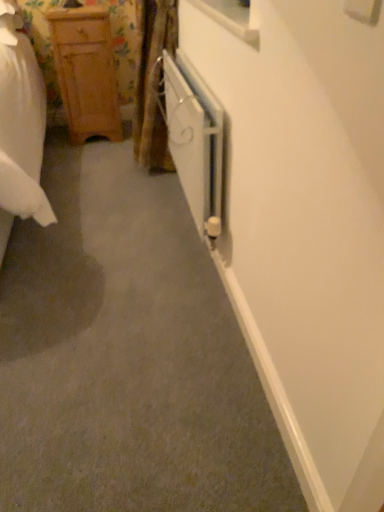
Question: In terms of size, does white matte radiator at center appear bigger or smaller than wooden cabinet at left?

Choices:
 (A) big
 (B) small

Answer: (B)

Question: From a real-world perspective, is white matte radiator at center positioned above or below wooden cabinet at left?

Choices:
 (A) below
 (B) above

Answer: (B)

Question: In terms of width, does white matte radiator at center look wider or thinner when compared to wooden cabinet at left?

Choices:
 (A) wide
 (B) thin

Answer: (B)

Question: Is wooden cabinet at left wider or thinner than white matte radiator at center?

Choices:
 (A) thin
 (B) wide

Answer: (B)

Question: From the image's perspective, relative to white matte radiator at center, is wooden cabinet at left above or below?

Choices:
 (A) above
 (B) below

Answer: (A)

Question: From a real-world perspective, relative to white matte radiator at center, is wooden cabinet at left vertically above or below?

Choices:
 (A) below
 (B) above

Answer: (A)

Question: Is point (72, 102) positioned closer to the camera than point (220, 207)?

Choices:
 (A) farther
 (B) closer

Answer: (A)